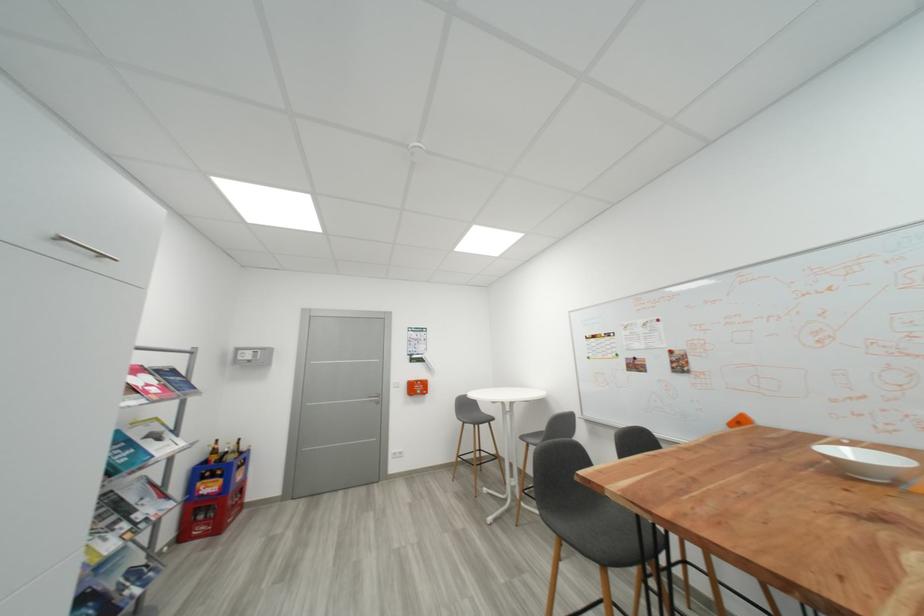
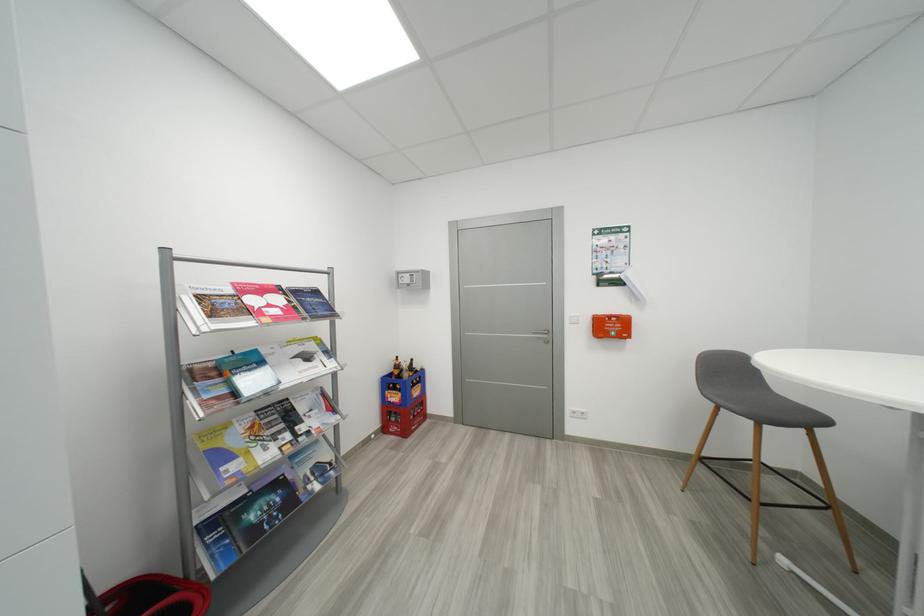
In the second image, find the point that corresponds to point 500,421 in the first image.

(833, 424)